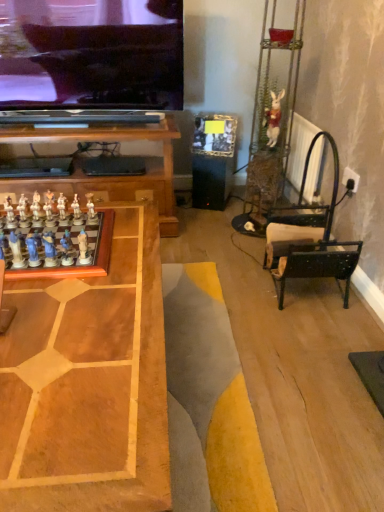
This screenshot has width=384, height=512. Identify the location of free space in front of white glossy chess piece at center-left, which is counted as the tenth toy, starting from the left. (73, 285).